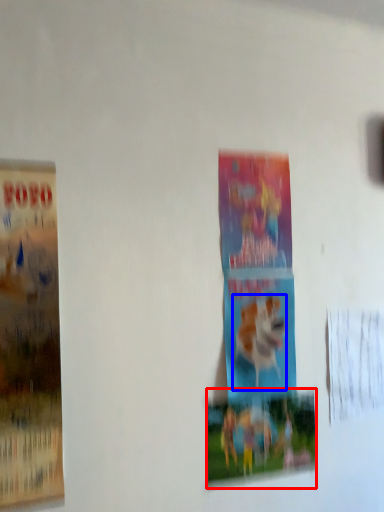
Question: Which of the following is the farthest to the observer, poster (highlighted by a red box) or animal (highlighted by a blue box)?

Choices:
 (A) poster
 (B) animal

Answer: (B)